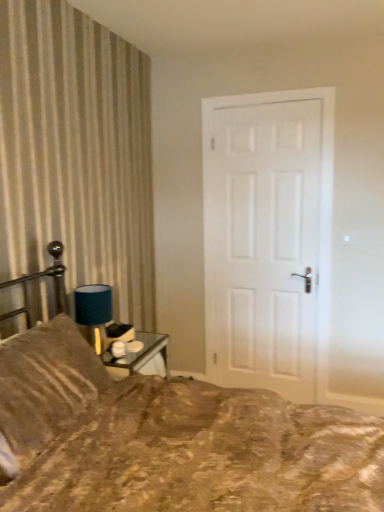
Question: Is white matte door at center wider or thinner than blue fabric lampshade at upper left?

Choices:
 (A) wide
 (B) thin

Answer: (B)

Question: In the image, is white matte door at center on the left side or the right side of blue fabric lampshade at upper left?

Choices:
 (A) right
 (B) left

Answer: (A)

Question: Which is farther from the brown textured pillow at left?

Choices:
 (A) brown textured fabric bed at lower left
 (B) white matte door at center
 (C) blue fabric lampshade at upper left

Answer: (B)

Question: Which of these objects is positioned closest to the brown textured fabric bed at lower left?

Choices:
 (A) brown textured pillow at left
 (B) white matte door at center
 (C) blue fabric lampshade at upper left

Answer: (A)